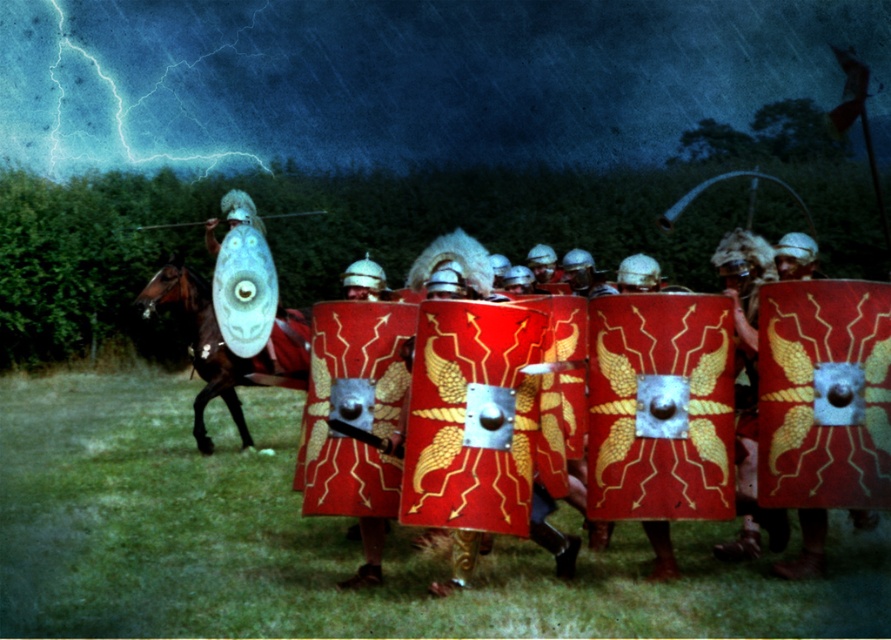
Question: In this image, where is shiny brown horse at left located relative to translucent plastic shield at center?

Choices:
 (A) left
 (B) right

Answer: (A)

Question: Can you confirm if shiny brown horse at left is bigger than translucent plastic shield at center?

Choices:
 (A) yes
 (B) no

Answer: (A)

Question: Is shiny brown horse at left smaller than translucent plastic shield at center?

Choices:
 (A) yes
 (B) no

Answer: (B)

Question: Which object appears farthest from the camera in this image?

Choices:
 (A) shiny brown horse at left
 (B) translucent plastic shield at center

Answer: (B)

Question: Among these points, which one is nearest to the camera?

Choices:
 (A) (248, 284)
 (B) (248, 380)

Answer: (B)